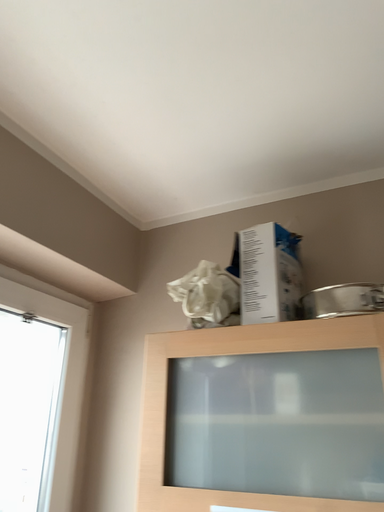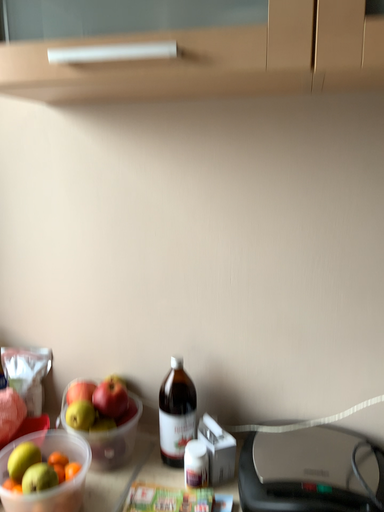
Question: How did the camera likely rotate when shooting the video?

Choices:
 (A) rotated downward
 (B) rotated upward

Answer: (A)